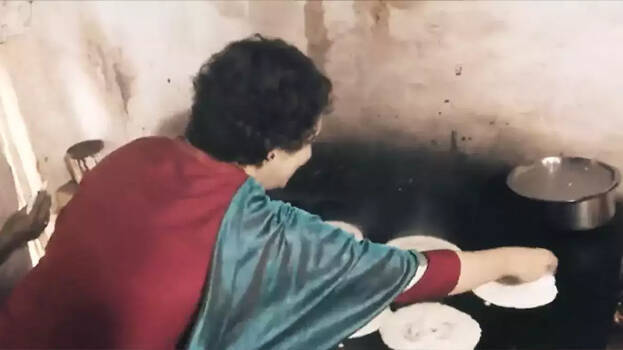
This screenshot has height=350, width=623. I want to click on wall, so click(128, 31), click(480, 40).